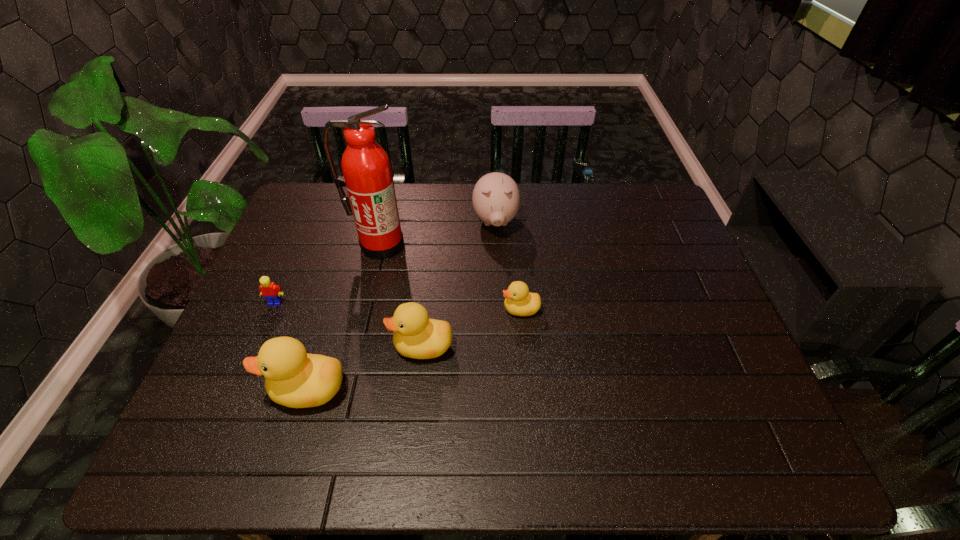
At what (x,y) coordinates should I click in order to perform the action: click on vacant region located on the front-facing side of the Lego. Please return your answer as a coordinate pair (x, y). This screenshot has height=540, width=960. Looking at the image, I should click on (250, 365).

This screenshot has width=960, height=540. I want to click on object that is at the far edge, so pos(496,199).

Image resolution: width=960 pixels, height=540 pixels. I want to click on object at the near edge, so click(294, 378).

The image size is (960, 540). In order to click on duckling located at the left edge in this screenshot , I will do `click(294, 378)`.

Locate an element on the screen. The height and width of the screenshot is (540, 960). Lego that is at the left edge is located at coordinates (271, 292).

The image size is (960, 540). In order to click on object present at the near left corner in this screenshot , I will do `click(294, 378)`.

This screenshot has height=540, width=960. I want to click on vacant area at the far edge of the desktop, so click(x=416, y=188).

Where is `vacant area at the near edge of the desktop`? vacant area at the near edge of the desktop is located at coordinates (392, 398).

Where is `vacant space at the left edge of the desktop`? vacant space at the left edge of the desktop is located at coordinates (260, 299).

Find the location of a particular element. The height and width of the screenshot is (540, 960). vacant space at the right edge of the desktop is located at coordinates (671, 327).